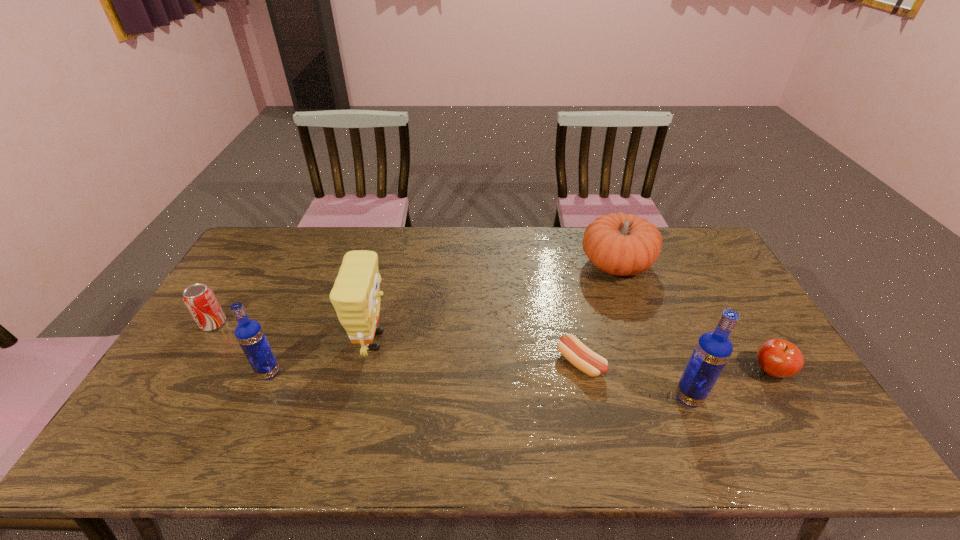
To achieve even spacing by inserting another vodka among them, please point to a vacant spot for this new vodka. Please provide its 2D coordinates. Your answer should be formatted as a tuple, i.e. [(x, y)], where the tuple contains the x and y coordinates of a point satisfying the conditions above.

[(473, 384)]